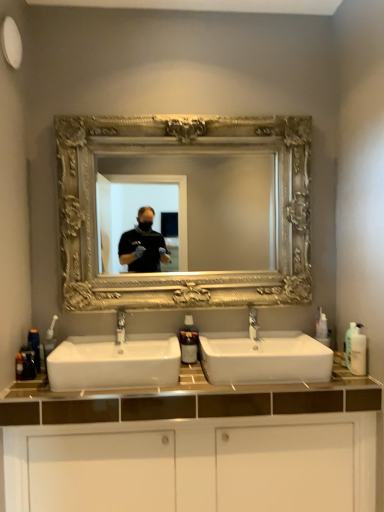
Identify the location of vacant area located to the right-hand side of translucent plastic bottle at lower left, the second toiletry when ordered from right to left. (44, 385).